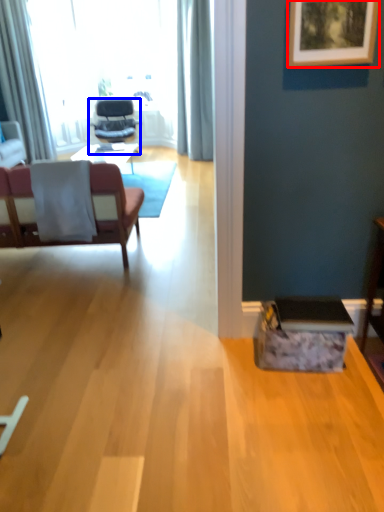
Question: Which point is closer to the camera, picture frame (highlighted by a red box) or chair (highlighted by a blue box)?

Choices:
 (A) picture frame
 (B) chair

Answer: (A)